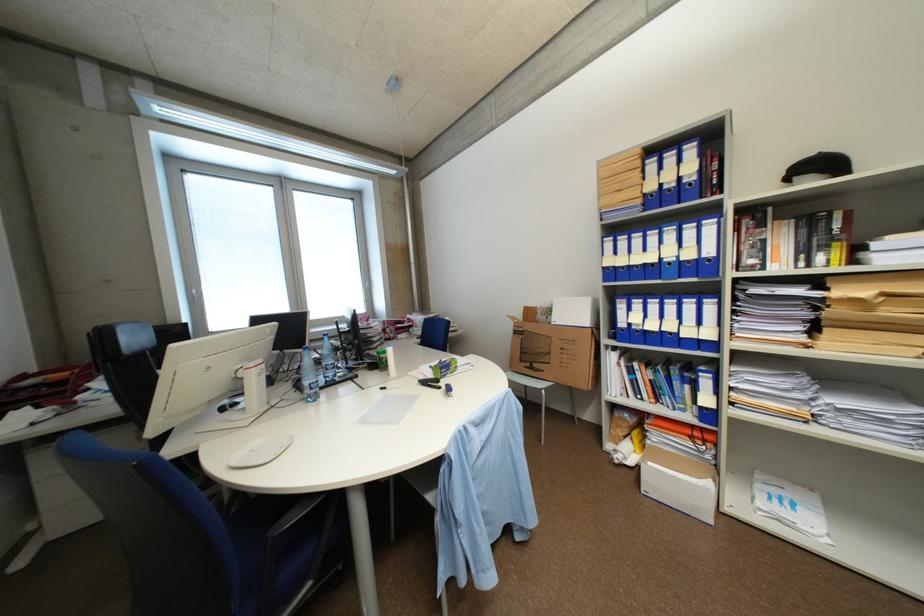
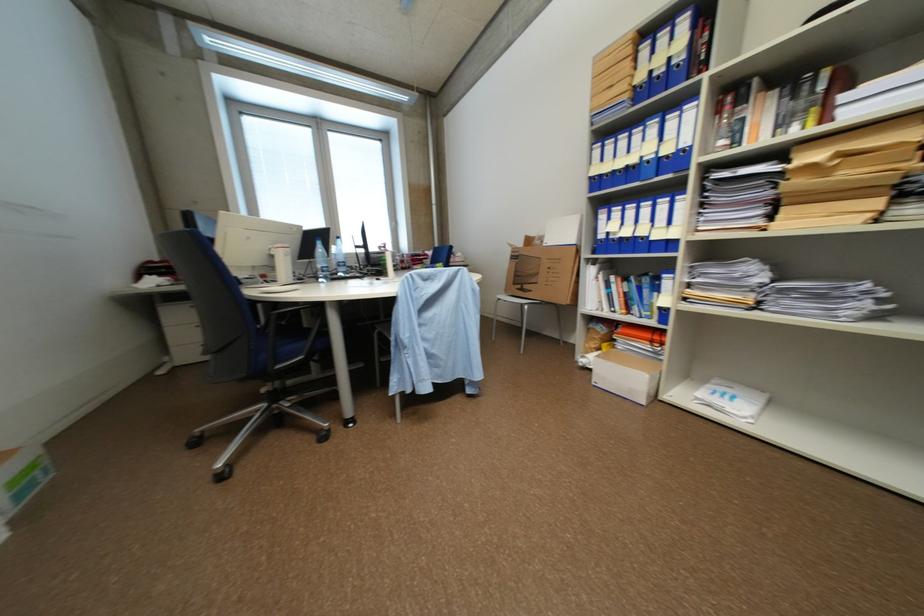
In a continuous first-person perspective shot, in which direction is the camera moving?

The cameraman moved toward right, backward.